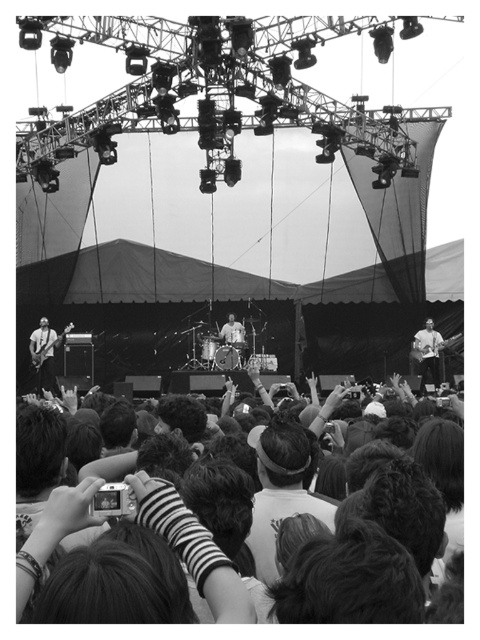
You are a photographer standing at the edge of the crowd. You want to take a photo that includes both the dark hair at lower center and the smooth white shirt at right. Given that your camera has a maximum focus range of 30 meters, will you be able to capture both subjects in focus?

The dark hair at lower center and smooth white shirt at right are 29.83 meters apart from each other. Since the distance between them is within the camera maximum focus range of 30 meters, you can capture both subjects in focus.

You are a photographer at the concert. You want to capture a closeup of the dark hair at lower center and the matte black guitar at left in the same frame. Can you fit both in your camera viewfinder if the viewfinder can only accommodate objects up to the width of the wider of the two?

The dark hair at lower center might be wider than matte black guitar at left, so it depends on which is wider. Since the viewfinder can only accommodate the wider one, if the dark hair at lower center is indeed wider, then both can fit only if the viewfinder can handle its width. However, since the description states it might be wider, there is uncertainty. The safest assumption is that the viewfinder can fit both as long as it matches the wider object.